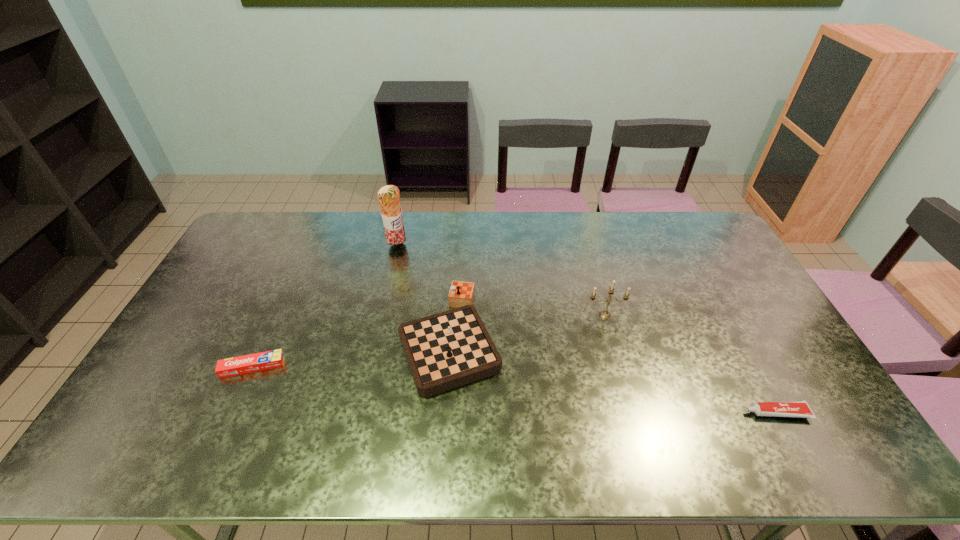
Where is `free point between the candle and the right toothpaste`? free point between the candle and the right toothpaste is located at coordinates (690, 364).

You are a GUI agent. You are given a task and a screenshot of the screen. Output one action in this format:
    pyautogui.click(x=<x>, y=<y>)
    Task: Click on the free space between the left toothpaste and the third shortest object
    This screenshot has width=960, height=540.
    Given the screenshot: What is the action you would take?
    pyautogui.click(x=351, y=353)

The height and width of the screenshot is (540, 960). What are the coordinates of `vacant space in between the candle and the nearest object` in the screenshot? It's located at (690, 364).

Select which object appears as the fourth closest to the nearest object. Please provide its 2D coordinates. Your answer should be formatted as a tuple, i.e. [(x, y)], where the tuple contains the x and y coordinates of a point satisfying the conditions above.

[(266, 360)]

Find the location of a particular element. Image resolution: width=960 pixels, height=540 pixels. object that is the third closest one to the fourth shortest object is located at coordinates (388, 196).

Locate an element on the screen. This screenshot has width=960, height=540. vacant space that satisfies the following two spatial constraints: 1. on the back side of the left toothpaste; 2. on the left side of the third tallest object is located at coordinates 265,339.